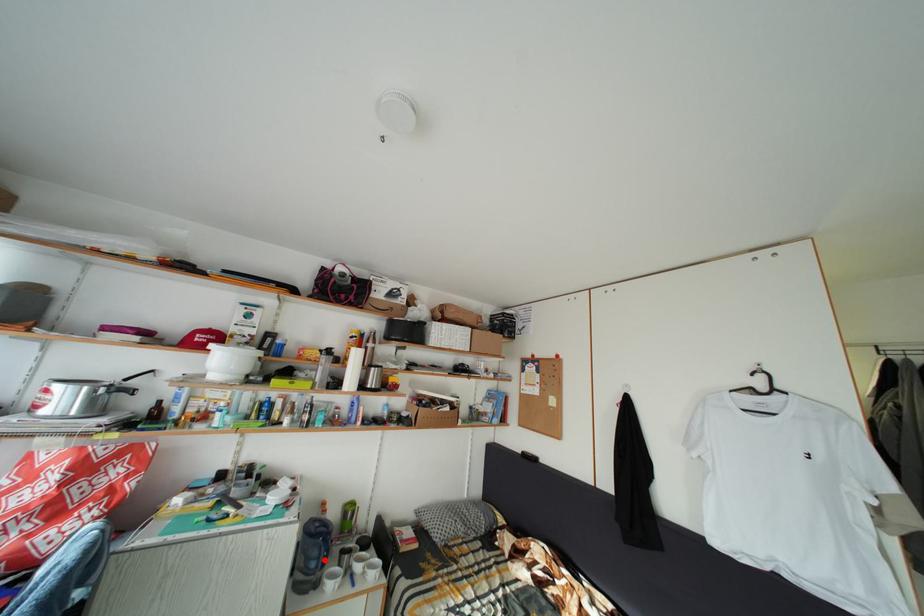
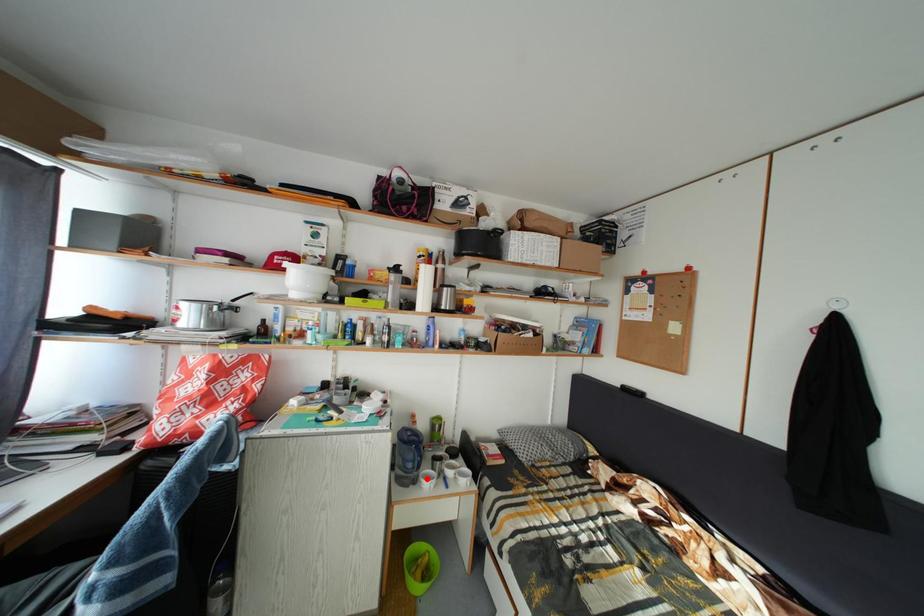
I am providing you with two images of the same scene from different viewpoints. A red point is marked on the first image and another point is marked on the second image. Is the marked point in image1 the same physical position as the marked point in image2?

No